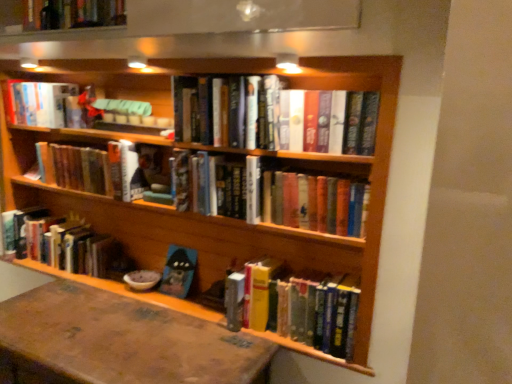
Question: Is hardcover book at lower left, the 3th book from the bottom, wider than hardcover books at center, marked as the 1th book in a bottom-to-top arrangement?

Choices:
 (A) yes
 (B) no

Answer: (B)

Question: Considering the relative sizes of hardcover book at lower left, the 3th book from the bottom, and hardcover books at center, marked as the 1th book in a bottom-to-top arrangement, in the image provided, is hardcover book at lower left, the 3th book from the bottom, smaller than hardcover books at center, marked as the 1th book in a bottom-to-top arrangement,?

Choices:
 (A) no
 (B) yes

Answer: (A)

Question: Is hardcover book at lower left, the 3th book from the bottom, thinner than hardcover books at center, marked as the 1th book in a bottom-to-top arrangement?

Choices:
 (A) yes
 (B) no

Answer: (A)

Question: Is hardcover book at lower left, the 3th book from the bottom, directly adjacent to hardcover books at center, which is the seventh book from top to bottom?

Choices:
 (A) no
 (B) yes

Answer: (A)

Question: Considering the relative sizes of hardcover book at lower left, acting as the 5th book starting from the top, and hardcover books at center, marked as the 1th book in a bottom-to-top arrangement, in the image provided, is hardcover book at lower left, acting as the 5th book starting from the top, bigger than hardcover books at center, marked as the 1th book in a bottom-to-top arrangement,?

Choices:
 (A) yes
 (B) no

Answer: (A)

Question: Is hardcover books at center, acting as the second book starting from the top, bigger or smaller than hardcover books at center, which is the fourth book in top-to-bottom order?

Choices:
 (A) small
 (B) big

Answer: (A)

Question: Looking at their shapes, would you say hardcover books at center, positioned as the sixth book in bottom-to-top order, is wider or thinner than hardcover books at center, the fourth book positioned from the bottom?

Choices:
 (A) thin
 (B) wide

Answer: (B)

Question: From a real-world perspective, is hardcover books at center, acting as the second book starting from the top, above or below hardcover books at center, which is the fourth book in top-to-bottom order?

Choices:
 (A) above
 (B) below

Answer: (A)

Question: Is hardcover books at center, acting as the second book starting from the top, in front of or behind hardcover books at center, the fourth book positioned from the bottom, in the image?

Choices:
 (A) front
 (B) behind

Answer: (B)

Question: Considering the relative positions of hardcover books at center, which is the seventh book from top to bottom, and brown leather table at lower left in the image provided, is hardcover books at center, which is the seventh book from top to bottom, to the left or to the right of brown leather table at lower left?

Choices:
 (A) left
 (B) right

Answer: (B)

Question: Is hardcover books at center, which is the seventh book from top to bottom, spatially inside brown leather table at lower left, or outside of it?

Choices:
 (A) outside
 (B) inside

Answer: (A)

Question: From a real-world perspective, relative to brown leather table at lower left, is hardcover books at center, which is the seventh book from top to bottom, vertically above or below?

Choices:
 (A) below
 (B) above

Answer: (B)

Question: From the image's perspective, is hardcover books at center, marked as the 1th book in a bottom-to-top arrangement, located above or below brown leather table at lower left?

Choices:
 (A) above
 (B) below

Answer: (A)

Question: Considering the positions of hardcover books at center, arranged as the third book when viewed from the top, and hardcover books at center, the fourth book positioned from the bottom, in the image, is hardcover books at center, arranged as the third book when viewed from the top, bigger or smaller than hardcover books at center, the fourth book positioned from the bottom,?

Choices:
 (A) small
 (B) big

Answer: (A)

Question: In the image, is hardcover books at center, arranged as the third book when viewed from the top, on the left side or the right side of hardcover books at center, the fourth book positioned from the bottom?

Choices:
 (A) left
 (B) right

Answer: (A)